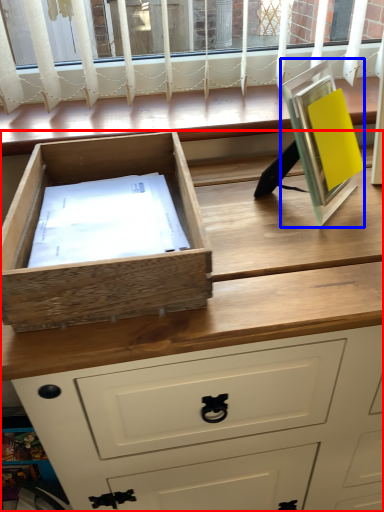
Question: Which point is closer to the camera, chest of drawers (highlighted by a red box) or picture frame (highlighted by a blue box)?

Choices:
 (A) chest of drawers
 (B) picture frame

Answer: (A)